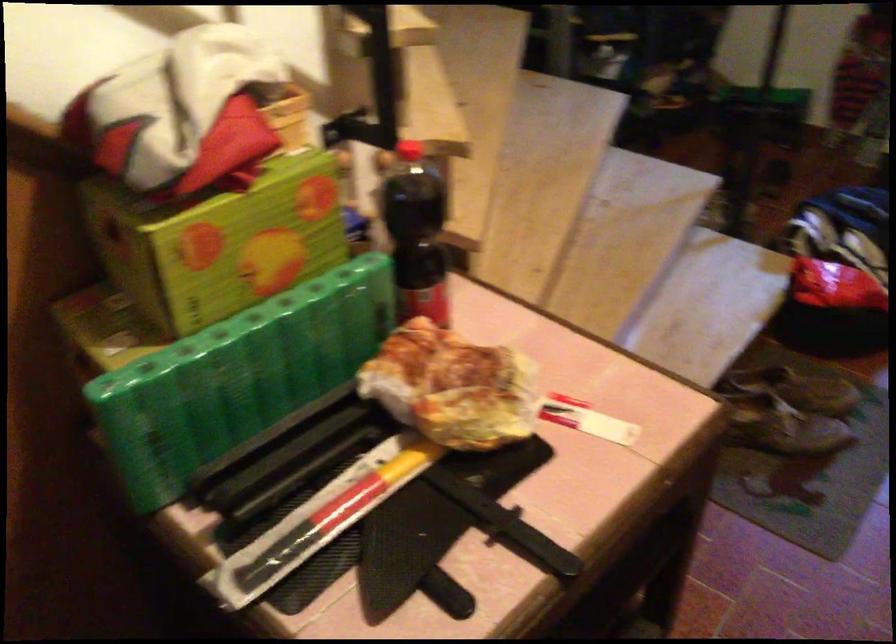
Question: The first image is from the beginning of the video and the second image is from the end. How did the camera likely rotate when shooting the video?

Choices:
 (A) Left
 (B) Right
 (C) Up
 (D) Down

Answer: (B)